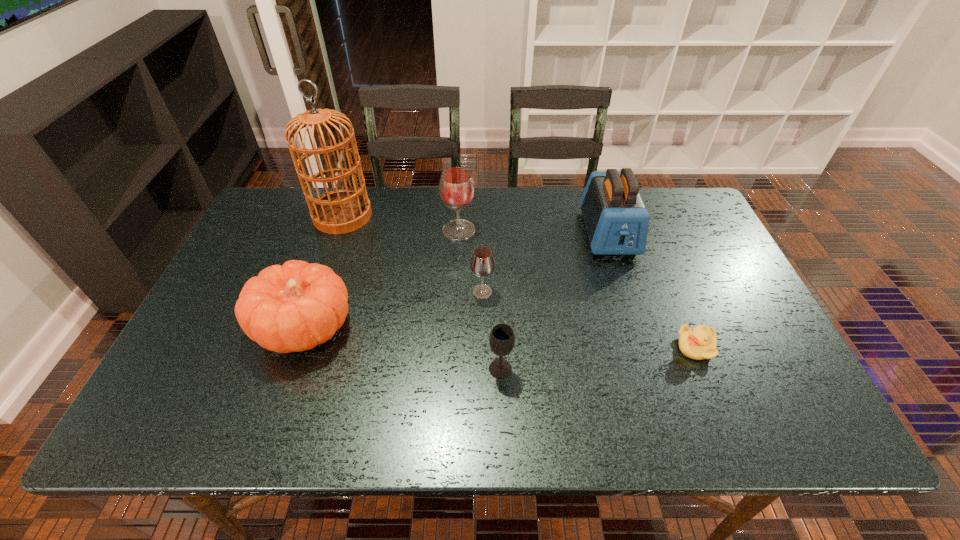
The image size is (960, 540). Find the location of `empty space between the pumpkin and the second object from right to left`. empty space between the pumpkin and the second object from right to left is located at coordinates (456, 281).

Identify the location of free space that is in between the farthest wineglass and the pumpkin. This screenshot has width=960, height=540. (382, 279).

Find the location of a particular element. empty space that is in between the tallest object and the nearest wineglass is located at coordinates (421, 292).

Find the location of `free spot between the second object from right to left and the second farthest wineglass`. free spot between the second object from right to left and the second farthest wineglass is located at coordinates (545, 263).

Select which object appears as the closest to the tallest wineglass. Please provide its 2D coordinates. Your answer should be formatted as a tuple, i.e. [(x, y)], where the tuple contains the x and y coordinates of a point satisfying the conditions above.

[(482, 264)]

Identify which object is the second closest to the duckling. Please provide its 2D coordinates. Your answer should be formatted as a tuple, i.e. [(x, y)], where the tuple contains the x and y coordinates of a point satisfying the conditions above.

[(502, 338)]

Locate an element on the screen. The height and width of the screenshot is (540, 960). wineglass that is the closest to the farthest wineglass is located at coordinates (482, 264).

Identify which wineglass is the third nearest to the pumpkin. Please provide its 2D coordinates. Your answer should be formatted as a tuple, i.e. [(x, y)], where the tuple contains the x and y coordinates of a point satisfying the conditions above.

[(502, 338)]

You are a GUI agent. You are given a task and a screenshot of the screen. Output one action in this format:
    pyautogui.click(x=<x>, y=<y>)
    Task: Click on the free spot that satisfies the following two spatial constraints: 1. on the back side of the pumpkin; 2. on the right side of the second farthest wineglass
    The image size is (960, 540).
    Given the screenshot: What is the action you would take?
    pyautogui.click(x=317, y=292)